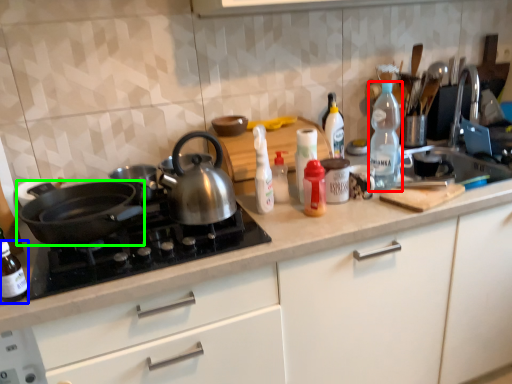
Question: Based on their relative distances, which object is nearer to bottle (highlighted by a red box)? Choose from bottle (highlighted by a blue box) and kitchen appliance (highlighted by a green box).

Choices:
 (A) bottle
 (B) kitchen appliance

Answer: (B)